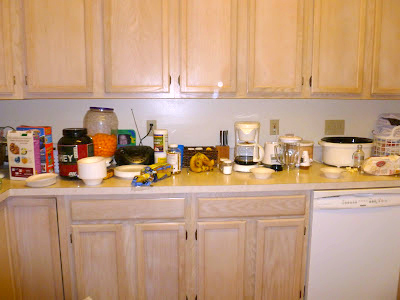
Where is `light switch`? This screenshot has width=400, height=300. light switch is located at coordinates (330, 130).